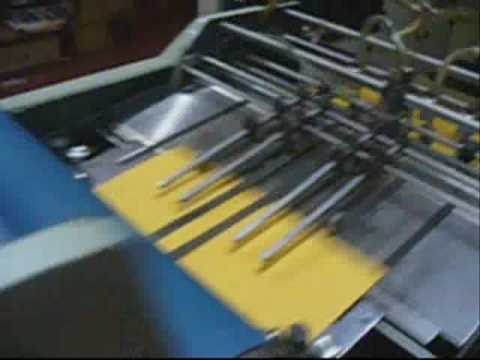
Image resolution: width=480 pixels, height=360 pixels. I want to click on rod, so click(x=212, y=117).